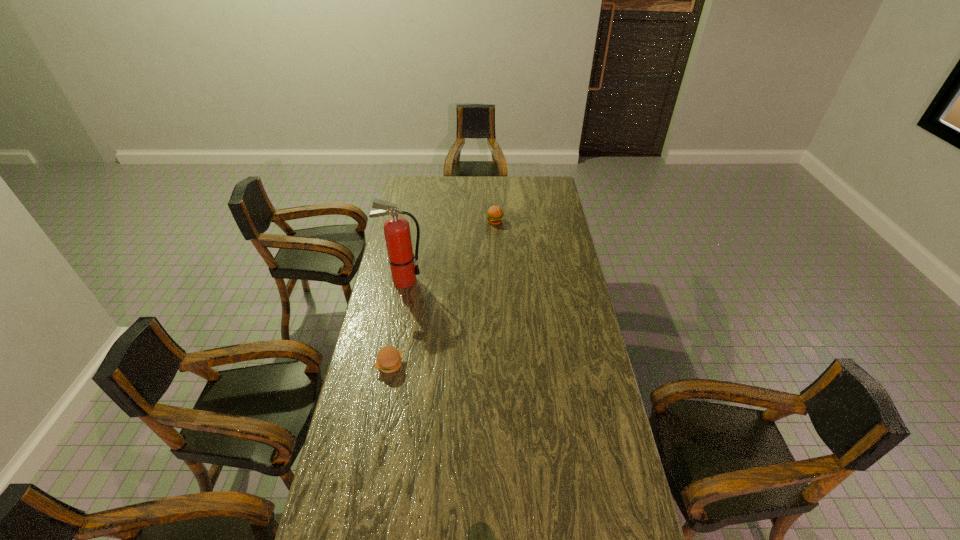
The width and height of the screenshot is (960, 540). I want to click on free space between the left hamburger and the second nearest object, so click(396, 322).

What are the coordinates of `free space between the nearer hamburger and the right hamburger` in the screenshot? It's located at (443, 293).

Where is `object that is the second closest to the farthest object`? The width and height of the screenshot is (960, 540). object that is the second closest to the farthest object is located at coordinates (388, 360).

Identify which object is the nearest to the rightmost object. Please provide its 2D coordinates. Your answer should be formatted as a tuple, i.e. [(x, y)], where the tuple contains the x and y coordinates of a point satisfying the conditions above.

[(397, 233)]

The image size is (960, 540). What are the coordinates of `blank area in the image that satisfies the following two spatial constraints: 1. on the front side of the farther hamburger; 2. on the hose direction of the second farthest object` in the screenshot? It's located at (497, 280).

Locate an element on the screen. vacant position in the image that satisfies the following two spatial constraints: 1. on the hose direction of the nearer hamburger; 2. on the left side of the second nearest object is located at coordinates (388, 364).

Locate an element on the screen. This screenshot has width=960, height=540. vacant region that satisfies the following two spatial constraints: 1. on the front side of the farther hamburger; 2. on the hose direction of the fire extinguisher is located at coordinates click(x=497, y=280).

Find the location of a particular element. This screenshot has width=960, height=540. free location that satisfies the following two spatial constraints: 1. on the back side of the nearest object; 2. on the hose direction of the fire extinguisher is located at coordinates [405, 280].